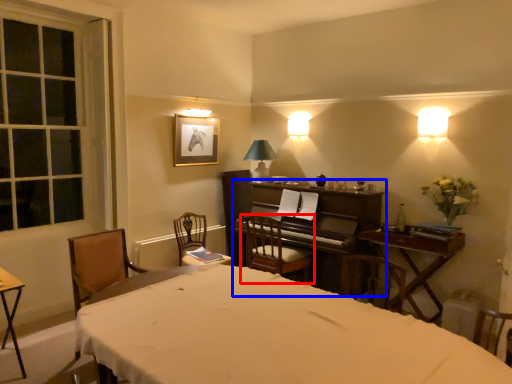
Question: Which of the following is the farthest to the observer, chair (highlighted by a red box) or piano (highlighted by a blue box)?

Choices:
 (A) chair
 (B) piano

Answer: (A)